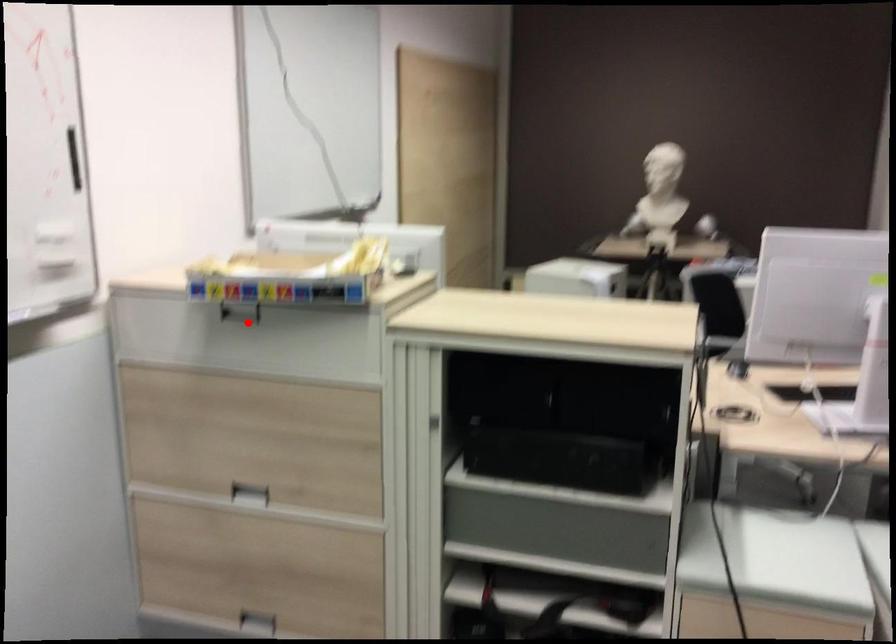
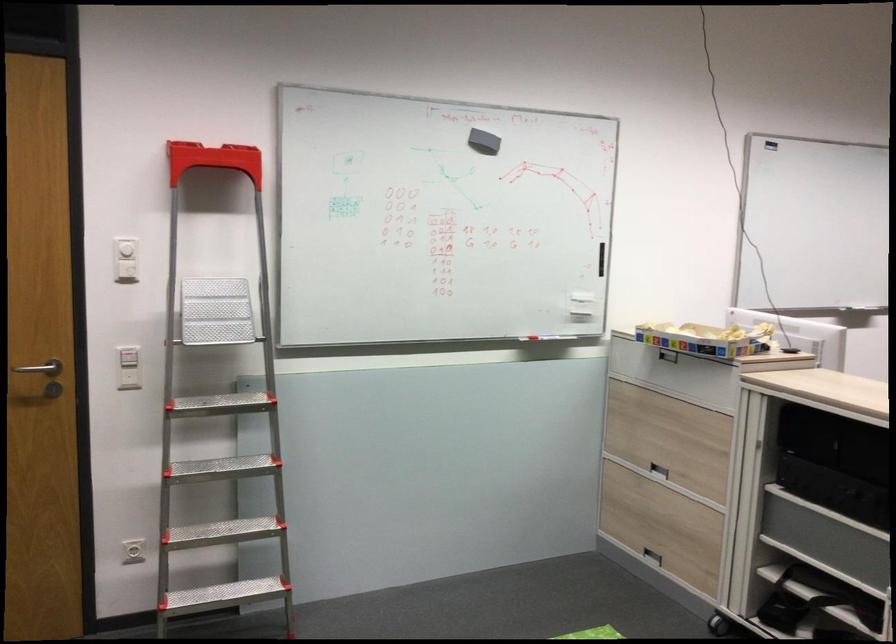
Question: I am providing you with two images of the same scene from different viewpoints. Image1 has a red point marked. In image2, the corresponding 3D location appears at what relative position? Reply with the corresponding letter.

Choices:
 (A) Closer
 (B) Farther

Answer: (B)